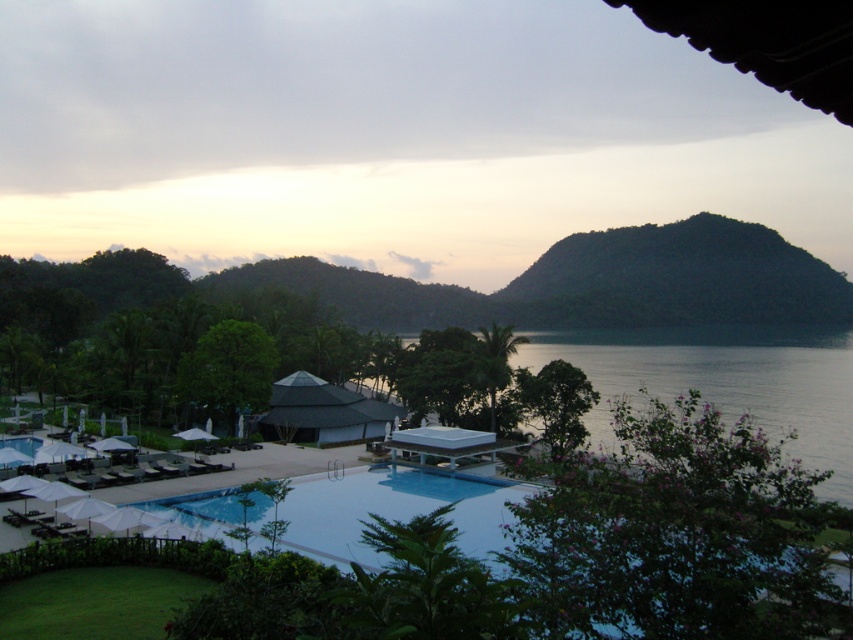
Question: Which object appears closest to the camera in this image?

Choices:
 (A) transparent glass water at center
 (B) transparent glass pool at center

Answer: (B)

Question: Which object is closer to the camera taking this photo?

Choices:
 (A) transparent glass water at center
 (B) transparent glass pool at center

Answer: (B)

Question: Does transparent glass pool at center appear on the right side of transparent glass water at center?

Choices:
 (A) no
 (B) yes

Answer: (A)

Question: Can you confirm if transparent glass pool at center is bigger than transparent glass water at center?

Choices:
 (A) no
 (B) yes

Answer: (A)

Question: Which object appears farthest from the camera in this image?

Choices:
 (A) transparent glass pool at center
 (B) transparent glass water at center

Answer: (B)

Question: Does transparent glass pool at center have a larger size compared to transparent glass water at center?

Choices:
 (A) no
 (B) yes

Answer: (A)